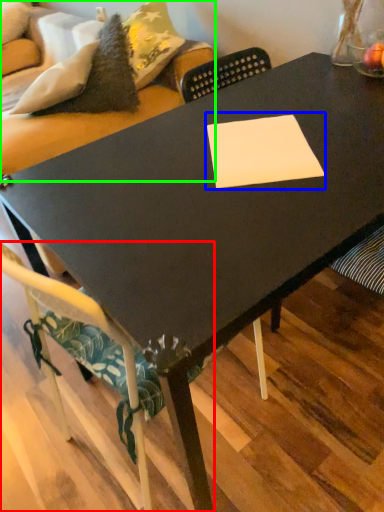
Question: Which is nearer to the chair (highlighted by a red box)? rectangle (highlighted by a blue box) or couch (highlighted by a green box).

Choices:
 (A) rectangle
 (B) couch

Answer: (A)